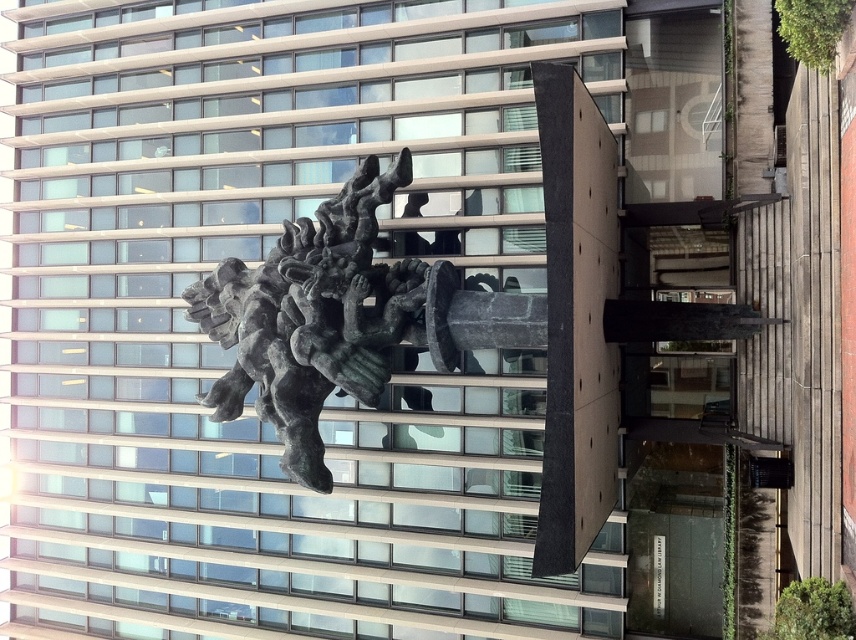
You are standing in front of the sculpture and want to take a photo that includes both the point at coordinates point (367, 577) and point (516, 317). Which point is closer to your camera when taking the photo?

Point (367, 577) is closer to the camera than point (516, 317) because it is further to the camera than the other point.

You are standing in front of the modern building with the sculpture nearby. The point at coordinates (232, 352) marks a specific feature. What is located at that point?

The point at (232, 352) indicates clear glass windows at center.